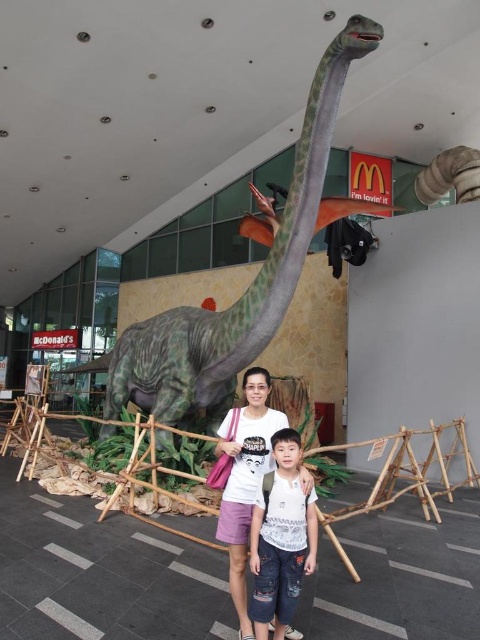
Does green matte dinosaur at center appear on the left side of matte white shirt at center?

Indeed, green matte dinosaur at center is positioned on the left side of matte white shirt at center.

From the picture: Can you confirm if green matte dinosaur at center is shorter than matte white shirt at center?

Incorrect, green matte dinosaur at center's height does not fall short of matte white shirt at center's.

Does point (278, 314) come farther from viewer compared to point (243, 387)?

Yes, point (278, 314) is behind point (243, 387).

Where is `green matte dinosaur at center`? This screenshot has height=640, width=480. green matte dinosaur at center is located at coordinates (245, 289).

Does green matte dinosaur at center have a smaller size compared to denim shorts at center?

No, green matte dinosaur at center is not smaller than denim shorts at center.

Who is lower down, green matte dinosaur at center or denim shorts at center?

denim shorts at center

Who is more distant from viewer, [311,180] or [257,609]?

Positioned behind is point [311,180].

Locate an element on the screen. Image resolution: width=480 pixels, height=640 pixels. green matte dinosaur at center is located at coordinates (245, 289).

Between point (292, 550) and point (265, 378), which one is positioned behind?

The point (265, 378) is behind.

Is point (277, 582) positioned in front of point (220, 449)?

Yes, point (277, 582) is in front of point (220, 449).

Is point (284, 577) positioned before point (228, 412)?

Yes, it is.

The image size is (480, 640). Find the location of `denim shorts at center`. denim shorts at center is located at coordinates (282, 540).